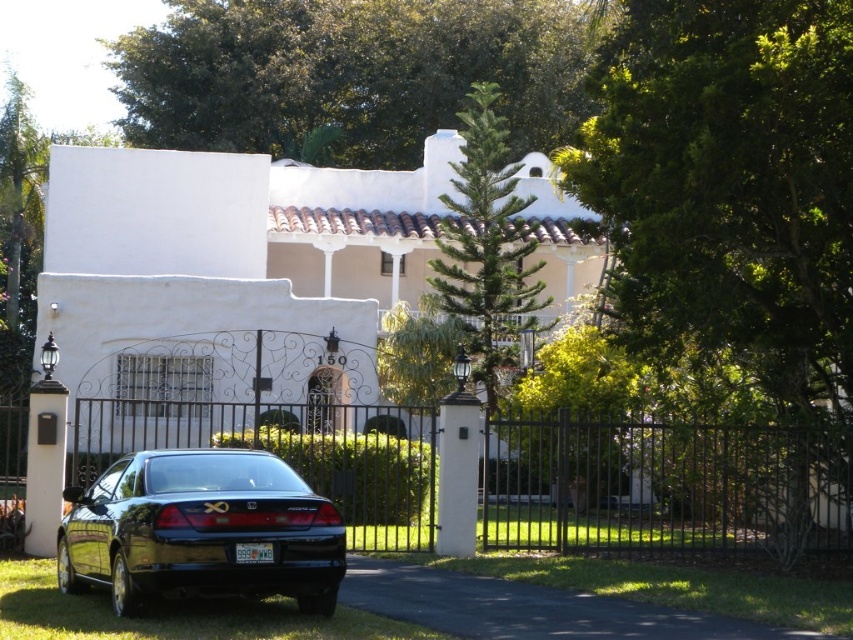
You are a delivery person approaching the entrance of the white stucco villa at center. You see the glossy black sedan at lower left parked nearby. From your vantage point, which object is positioned higher in the image?

The white stucco villa at center is located above the glossy black sedan at lower left, so the white stucco villa at center is positioned higher in the image.

You are standing in front of the house and want to take a photo of the white stucco villa at center. If your camera has a maximum zoom range of 15 meters, will you be able to capture the entire villa in the photo without moving closer?

The white stucco villa at center is 16.08 meters away from the camera. Since the maximum zoom range is 15 meters, you won not be able to capture the entire villa in the photo without moving closer.